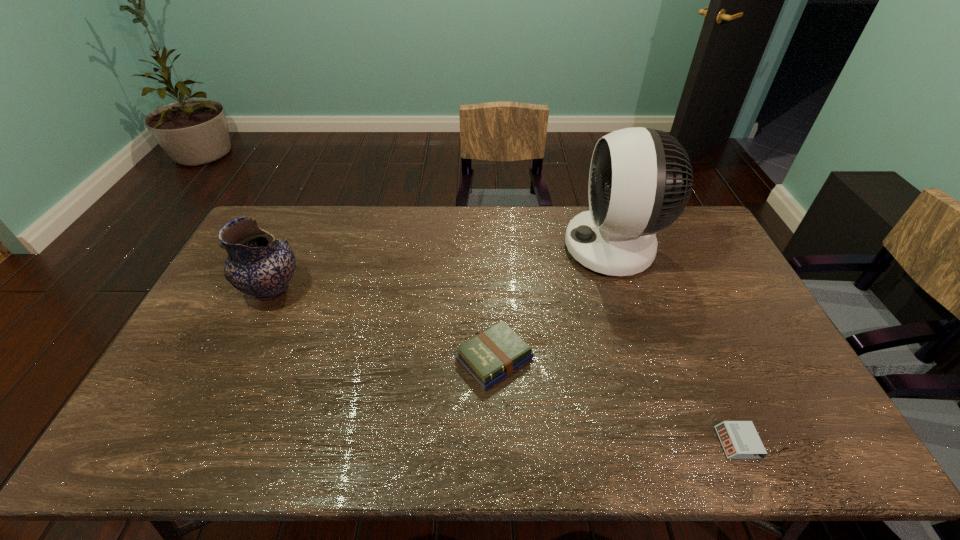
Locate an element on the screen. The height and width of the screenshot is (540, 960). vacant space located on the right of the second tallest object is located at coordinates (319, 290).

Locate an element on the screen. This screenshot has width=960, height=540. free spot located 0.100m on the right of the third tallest object is located at coordinates (569, 358).

Image resolution: width=960 pixels, height=540 pixels. I want to click on free space located 0.170m on the back of the alarm clock, so click(x=706, y=368).

Locate an element on the screen. object that is at the far edge is located at coordinates (640, 179).

Locate an element on the screen. The height and width of the screenshot is (540, 960). object that is at the near edge is located at coordinates (740, 440).

Where is `object that is at the left edge`? object that is at the left edge is located at coordinates (258, 264).

Image resolution: width=960 pixels, height=540 pixels. In the image, there is a desktop. What are the coordinates of `vacant region at the far edge` in the screenshot? It's located at tap(347, 235).

You are a GUI agent. You are given a task and a screenshot of the screen. Output one action in this format:
    pyautogui.click(x=<x>, y=<y>)
    Task: Click on the free spot at the near edge of the desktop
    
    Given the screenshot: What is the action you would take?
    pyautogui.click(x=581, y=452)

Locate an element on the screen. The image size is (960, 540). free space at the left edge of the desktop is located at coordinates (245, 304).

Locate an element on the screen. The width and height of the screenshot is (960, 540). free space at the right edge of the desktop is located at coordinates (691, 276).